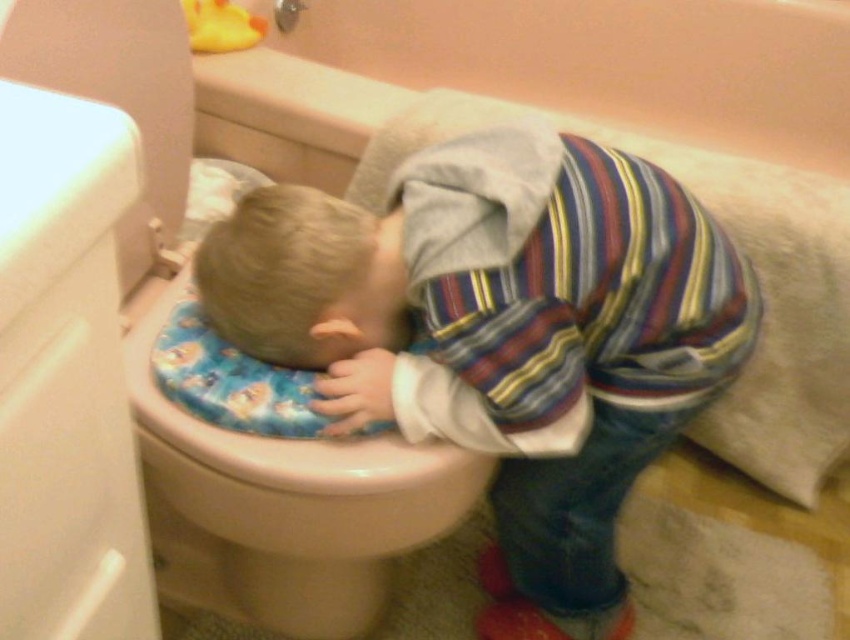
Consider the image. Can you confirm if striped fabric shirt at center is positioned to the right of blonde hair at center?

Yes, striped fabric shirt at center is to the right of blonde hair at center.

Is striped fabric shirt at center below blonde hair at center?

Yes, striped fabric shirt at center is below blonde hair at center.

Is point (292, 189) positioned in front of point (298, 301)?

That is False.

This screenshot has width=850, height=640. Identify the location of striped fabric shirt at center. (503, 337).

Between striped fabric shirt at center and white glossy toilet at left, which one has less height?

striped fabric shirt at center

Can you confirm if striped fabric shirt at center is smaller than white glossy toilet at left?

Yes, striped fabric shirt at center is smaller than white glossy toilet at left.

What do you see at coordinates (503, 337) in the screenshot?
I see `striped fabric shirt at center` at bounding box center [503, 337].

At what (x,y) coordinates should I click in order to perform the action: click on striped fabric shirt at center. Please return your answer as a coordinate pair (x, y). This screenshot has width=850, height=640. Looking at the image, I should click on (503, 337).

Based on the photo, between white glossy toilet at left and blonde hair at center, which one appears on the right side from the viewer's perspective?

blonde hair at center is more to the right.

Can you confirm if white glossy toilet at left is taller than blonde hair at center?

Correct, white glossy toilet at left is much taller as blonde hair at center.

The width and height of the screenshot is (850, 640). What are the coordinates of `white glossy toilet at left` in the screenshot? It's located at (131, 374).

You are a GUI agent. You are given a task and a screenshot of the screen. Output one action in this format:
    pyautogui.click(x=<x>, y=<y>)
    Task: Click on the white glossy toilet at left
    This screenshot has width=850, height=640.
    Given the screenshot: What is the action you would take?
    pyautogui.click(x=131, y=374)